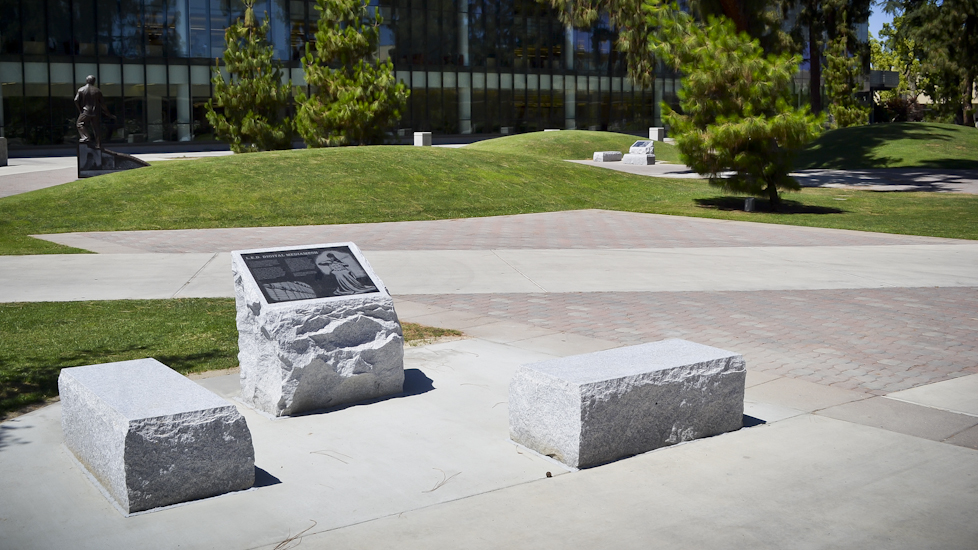
Where is `plaque`? This screenshot has height=550, width=978. plaque is located at coordinates (318, 287), (641, 142).